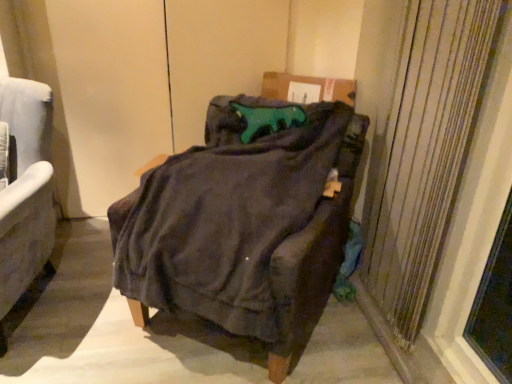
At what (x,y) coordinates should I click in order to perform the action: click on dark fabric chair at center, which is counted as the 1th chair, starting from the right. Please return your answer as a coordinate pair (x, y). Looking at the image, I should click on (245, 222).

Identify the location of textured beige curtain at right. (423, 153).

You are a GUI agent. You are given a task and a screenshot of the screen. Output one action in this format:
    pyautogui.click(x=<x>, y=<y>)
    Task: Click on the dark fabric chair at center, which is counted as the 1th chair, starting from the right
    The width and height of the screenshot is (512, 384).
    Given the screenshot: What is the action you would take?
    pyautogui.click(x=245, y=222)

Looking at the image, does dark fabric chair at center, which is counted as the 1th chair, starting from the right, seem bigger or smaller compared to textured beige curtain at right?

dark fabric chair at center, which is counted as the 1th chair, starting from the right, is bigger than textured beige curtain at right.

Looking at this image, is dark fabric chair at center, which ranks as the 2th chair in left-to-right order, positioned with its back to textured beige curtain at right?

No.

Is dark fabric chair at center, which is counted as the 1th chair, starting from the right, positioned far away from textured beige curtain at right?

dark fabric chair at center, which is counted as the 1th chair, starting from the right, is near textured beige curtain at right, not far away.

From the image's perspective, is velvet gray armchair at left, the second chair positioned from the right, on top of textured beige curtain at right?

Incorrect, from the image's perspective, velvet gray armchair at left, the second chair positioned from the right, is lower than textured beige curtain at right.

In the scene shown: From a real-world perspective, does velvet gray armchair at left, the first chair viewed from the left, sit lower than textured beige curtain at right?

Yes, from a real-world perspective, velvet gray armchair at left, the first chair viewed from the left, is under textured beige curtain at right.

Considering the positions of objects velvet gray armchair at left, the second chair positioned from the right, and textured beige curtain at right in the image provided, who is more to the right, velvet gray armchair at left, the second chair positioned from the right, or textured beige curtain at right?

From the viewer's perspective, textured beige curtain at right appears more on the right side.

From their relative heights in the image, would you say textured beige curtain at right is taller or shorter than dark fabric chair at center, which ranks as the 2th chair in left-to-right order?

Considering their sizes, textured beige curtain at right has more height than dark fabric chair at center, which ranks as the 2th chair in left-to-right order.

Is textured beige curtain at right looking in the opposite direction of dark fabric chair at center, which is counted as the 1th chair, starting from the right?

Yes, textured beige curtain at right is facing away from dark fabric chair at center, which is counted as the 1th chair, starting from the right.

Based on the photo, from the image's perspective, is textured beige curtain at right located above dark fabric chair at center, which is counted as the 1th chair, starting from the right?

Correct, textured beige curtain at right appears higher than dark fabric chair at center, which is counted as the 1th chair, starting from the right, in the image.

From a real-world perspective, relative to dark fabric chair at center, which is counted as the 1th chair, starting from the right, is textured beige curtain at right vertically above or below?

Clearly, from a real-world perspective, textured beige curtain at right is above dark fabric chair at center, which is counted as the 1th chair, starting from the right.

Is velvet gray armchair at left, the first chair viewed from the left, surrounding dark fabric chair at center, which is counted as the 1th chair, starting from the right?

That's incorrect, dark fabric chair at center, which is counted as the 1th chair, starting from the right, is not inside velvet gray armchair at left, the first chair viewed from the left.

Is velvet gray armchair at left, the second chair positioned from the right, facing towards dark fabric chair at center, which is counted as the 1th chair, starting from the right?

No, velvet gray armchair at left, the second chair positioned from the right, is not oriented towards dark fabric chair at center, which is counted as the 1th chair, starting from the right.

Measure the distance from velvet gray armchair at left, the first chair viewed from the left, to dark fabric chair at center, which ranks as the 2th chair in left-to-right order.

velvet gray armchair at left, the first chair viewed from the left, and dark fabric chair at center, which ranks as the 2th chair in left-to-right order, are 29.34 inches apart.

Consider the image. How different are the orientations of velvet gray armchair at left, the second chair positioned from the right, and dark fabric chair at center, which ranks as the 2th chair in left-to-right order, in degrees?

velvet gray armchair at left, the second chair positioned from the right, and dark fabric chair at center, which ranks as the 2th chair in left-to-right order, are facing 16.9 degrees away from each other.

From a real-world perspective, between textured beige curtain at right and velvet gray armchair at left, the second chair positioned from the right, who is vertically lower?

velvet gray armchair at left, the second chair positioned from the right, from a real-world perspective.

Relative to velvet gray armchair at left, the second chair positioned from the right, is textured beige curtain at right in front or behind?

textured beige curtain at right is positioned closer to the viewer than velvet gray armchair at left, the second chair positioned from the right.

Which of these two, textured beige curtain at right or velvet gray armchair at left, the second chair positioned from the right, is smaller?

With smaller size is textured beige curtain at right.

Is textured beige curtain at right not near velvet gray armchair at left, the second chair positioned from the right?

textured beige curtain at right is positioned a significant distance from velvet gray armchair at left, the second chair positioned from the right.

Find the location of a particular element. The height and width of the screenshot is (384, 512). chair lying behind the dark fabric chair at center, which is counted as the 1th chair, starting from the right is located at coordinates (26, 192).

Is dark fabric chair at center, which is counted as the 1th chair, starting from the right, smaller than velvet gray armchair at left, the second chair positioned from the right?

No, dark fabric chair at center, which is counted as the 1th chair, starting from the right, is not smaller than velvet gray armchair at left, the second chair positioned from the right.

Considering the relative sizes of dark fabric chair at center, which is counted as the 1th chair, starting from the right, and velvet gray armchair at left, the second chair positioned from the right, in the image provided, is dark fabric chair at center, which is counted as the 1th chair, starting from the right, taller than velvet gray armchair at left, the second chair positioned from the right,?

In fact, dark fabric chair at center, which is counted as the 1th chair, starting from the right, may be shorter than velvet gray armchair at left, the second chair positioned from the right.

Where is `curtain on the right of dark fabric chair at center, which ranks as the 2th chair in left-to-right order`? This screenshot has width=512, height=384. curtain on the right of dark fabric chair at center, which ranks as the 2th chair in left-to-right order is located at coordinates pyautogui.click(x=423, y=153).

From the textured beige curtain at right, count the 2nd chair to the left and point to it. Please provide its 2D coordinates.

[(26, 192)]

Which object lies further to the anchor point velvet gray armchair at left, the second chair positioned from the right, dark fabric chair at center, which is counted as the 1th chair, starting from the right, or textured beige curtain at right?

textured beige curtain at right is further to velvet gray armchair at left, the second chair positioned from the right.

From the picture: When comparing their distances from velvet gray armchair at left, the first chair viewed from the left, does textured beige curtain at right or dark fabric chair at center, which ranks as the 2th chair in left-to-right order, seem further?

textured beige curtain at right lies further to velvet gray armchair at left, the first chair viewed from the left, than the other object.

Looking at this image, which object lies nearer to the anchor point textured beige curtain at right, velvet gray armchair at left, the first chair viewed from the left, or dark fabric chair at center, which ranks as the 2th chair in left-to-right order?

Among the two, dark fabric chair at center, which ranks as the 2th chair in left-to-right order, is located nearer to textured beige curtain at right.

Which object lies nearer to the anchor point dark fabric chair at center, which is counted as the 1th chair, starting from the right, velvet gray armchair at left, the second chair positioned from the right, or textured beige curtain at right?

Among the two, textured beige curtain at right is located nearer to dark fabric chair at center, which is counted as the 1th chair, starting from the right.

When comparing their distances from textured beige curtain at right, does dark fabric chair at center, which ranks as the 2th chair in left-to-right order, or velvet gray armchair at left, the first chair viewed from the left, seem further?

velvet gray armchair at left, the first chair viewed from the left, lies further to textured beige curtain at right than the other object.

From the picture: Estimate the real-world distances between objects in this image. Which object is further from dark fabric chair at center, which is counted as the 1th chair, starting from the right, textured beige curtain at right or velvet gray armchair at left, the first chair viewed from the left?

velvet gray armchair at left, the first chair viewed from the left.

Locate an element on the screen. chair situated between velvet gray armchair at left, the first chair viewed from the left, and textured beige curtain at right from left to right is located at coordinates (245, 222).